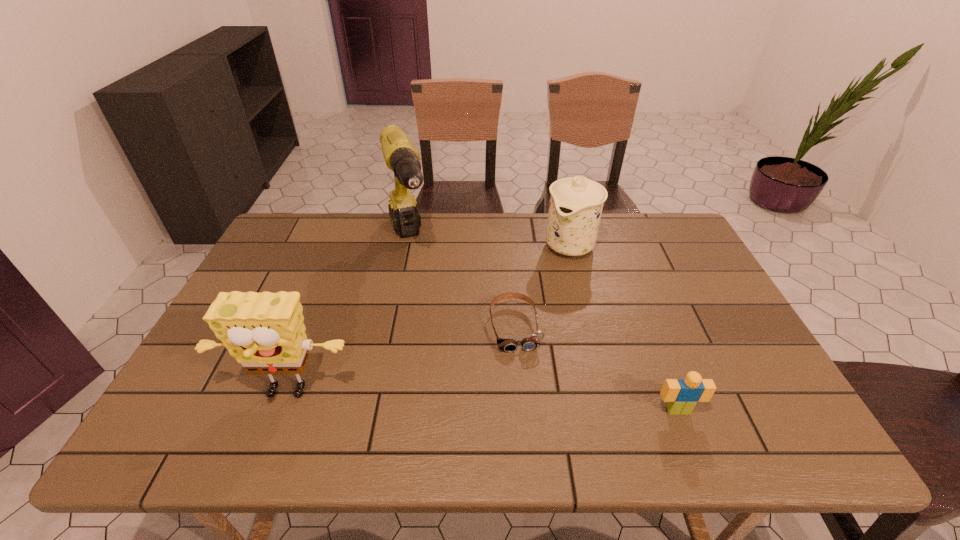
What are the coordinates of `empty space that is in between the tallest object and the second object from right to left` in the screenshot? It's located at (x=489, y=243).

Find the location of `blank region between the tallest object and the sponge`. blank region between the tallest object and the sponge is located at coordinates (348, 318).

Where is `vacant space in between the sponge and the goggles`? This screenshot has height=540, width=960. vacant space in between the sponge and the goggles is located at coordinates (400, 360).

Locate an element on the screen. vacant space in between the rightmost object and the sponge is located at coordinates (482, 402).

This screenshot has width=960, height=540. I want to click on blank region between the second object from right to left and the second shortest object, so click(x=623, y=327).

Identify the location of vacant space that's between the fourth tallest object and the tallest object. (543, 326).

Image resolution: width=960 pixels, height=540 pixels. I want to click on free space between the third nearest object and the drill, so click(462, 285).

Identify which object is the third nearest to the tallest object. Please provide its 2D coordinates. Your answer should be formatted as a tuple, i.e. [(x, y)], where the tuple contains the x and y coordinates of a point satisfying the conditions above.

[(265, 332)]

Choose which object is the third nearest neighbor to the goggles. Please provide its 2D coordinates. Your answer should be formatted as a tuple, i.e. [(x, y)], where the tuple contains the x and y coordinates of a point satisfying the conditions above.

[(682, 395)]

This screenshot has width=960, height=540. In order to click on free location that satisfies the following two spatial constraints: 1. on the front side of the drill; 2. on the right side of the chinaware in this screenshot , I will do coord(408,245).